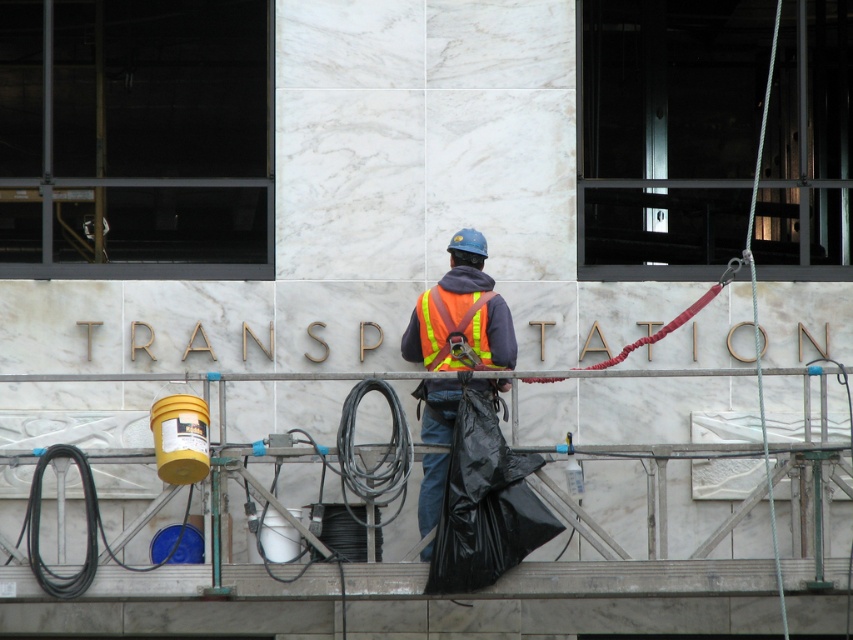
Question: Does reflective orange safety vest at center have a smaller size compared to hi-visibility reflective safety vest at center?

Choices:
 (A) no
 (B) yes

Answer: (A)

Question: Among these objects, which one is farthest from the camera?

Choices:
 (A) reflective orange safety vest at center
 (B) hi-visibility reflective safety vest at center

Answer: (B)

Question: Does reflective orange safety vest at center have a smaller size compared to hi-visibility reflective safety vest at center?

Choices:
 (A) no
 (B) yes

Answer: (A)

Question: Does reflective orange safety vest at center appear on the right side of hi-visibility reflective safety vest at center?

Choices:
 (A) yes
 (B) no

Answer: (B)